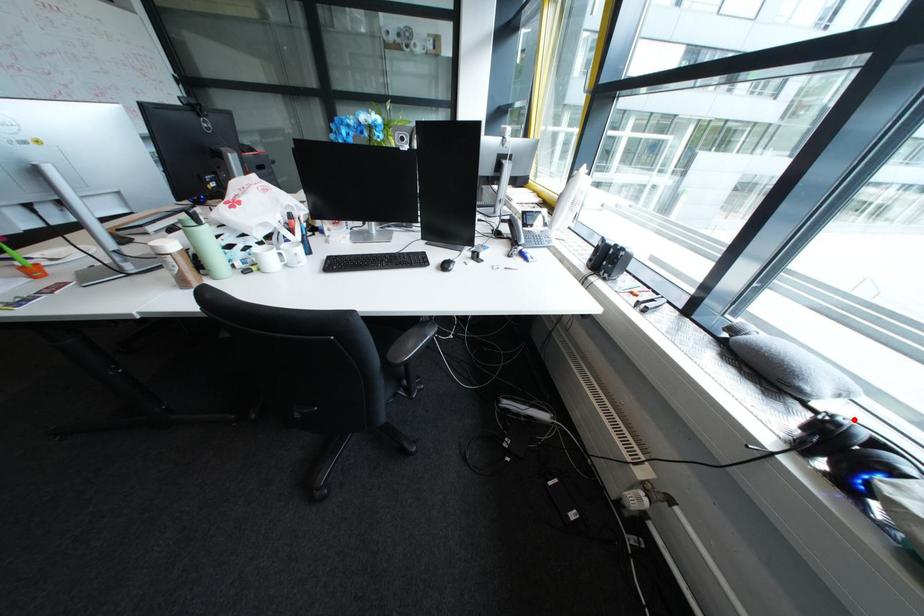
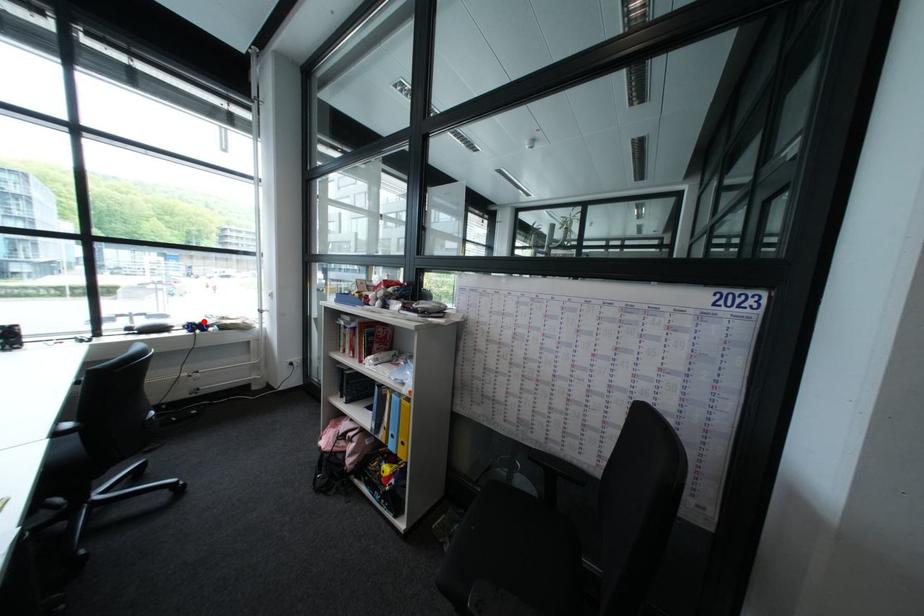
I am providing you with two images of the same scene from different viewpoints. A red point is marked on the first image and another point is marked on the second image. Does the point marked in image1 correspond to the same location as the one in image2?

Yes